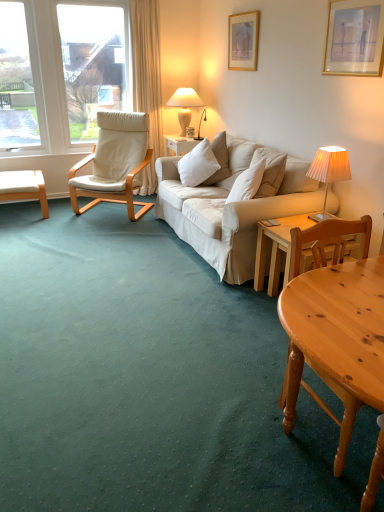
The width and height of the screenshot is (384, 512). I want to click on vacant area situated below white leather chair at left (from a real-world perspective), so click(107, 211).